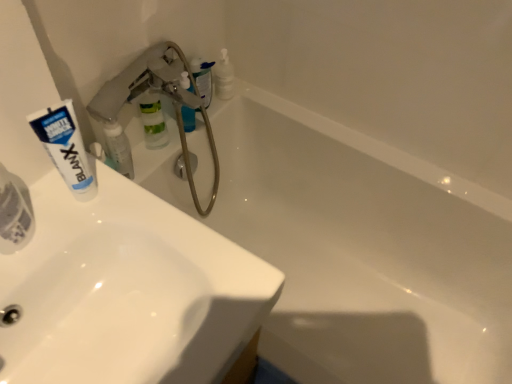
This screenshot has width=512, height=384. I want to click on vacant area on top of white glossy sink at upper left, positioned as the second sink in front-to-back order (from a real-world perspective), so click(x=104, y=328).